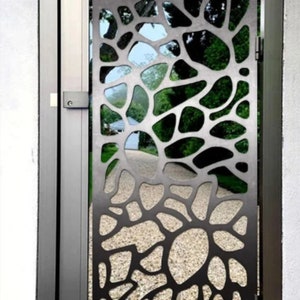
Locate an element on the screen. This screenshot has height=300, width=300. white wall is located at coordinates (20, 175), (291, 149).